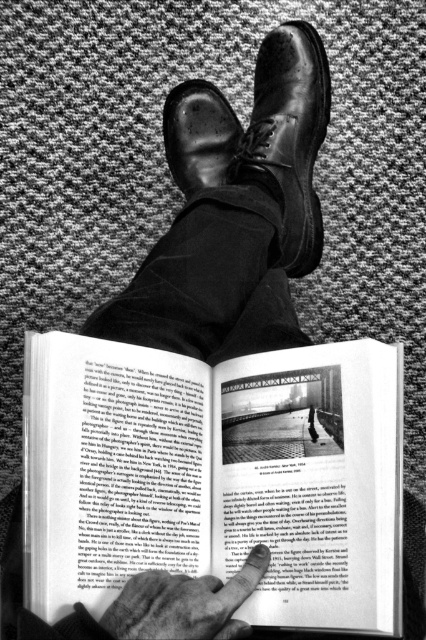
From the picture: What object is located at the coordinates point [261,136] in the image?

The shiny leather shoe at center is located at point [261,136].

You are a delivery robot with a package that needs to be placed between the shiny leather shoe at center and the smooth skin finger at lower center. The package is 50 centimeters long. Can you fit it there?

The distance between the shiny leather shoe at center and the smooth skin finger at lower center is 56.63 centimeters. Since the package is 50 centimeters long, it can fit in the space between them.

What object is located at the coordinates point (215, 476) in the image?

The point (215, 476) marks the matte paper book at center.